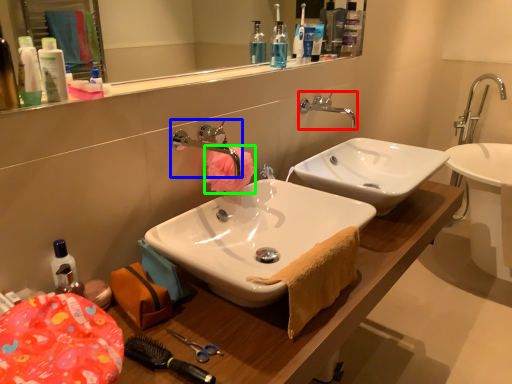
Question: Which object is positioned closest to tap (highlighted by a red box)? Select from tap (highlighted by a blue box) and flower (highlighted by a green box).

Choices:
 (A) tap
 (B) flower

Answer: (B)